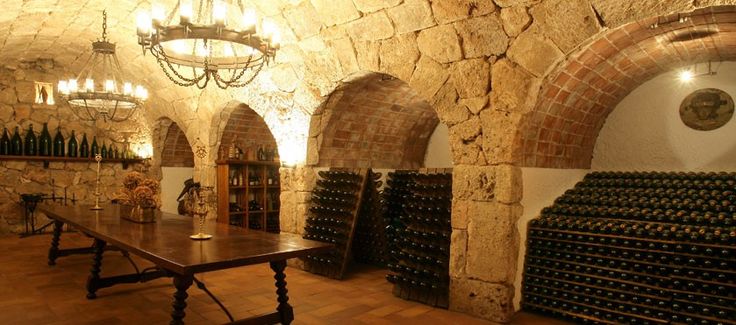
This screenshot has height=325, width=736. Find the location of `floor to right of table`. floor to right of table is located at coordinates (260, 268).